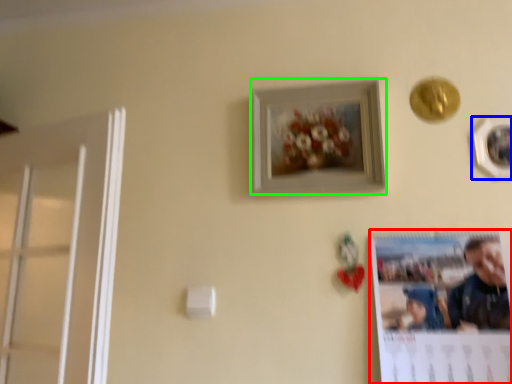
Question: Considering the real-world distances, which object is farthest from poster page (highlighted by a red box)? picture frame (highlighted by a blue box) or picture frame (highlighted by a green box)?

Choices:
 (A) picture frame
 (B) picture frame

Answer: (A)